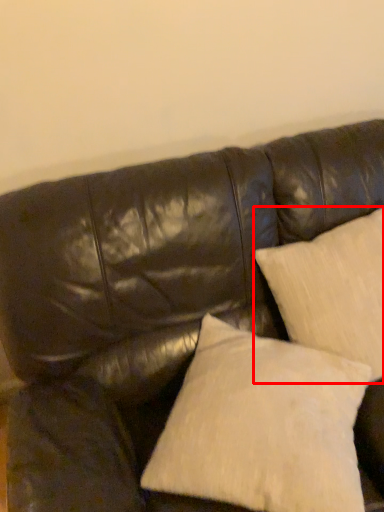
Question: From the image's perspective, what is the correct spatial positioning of pillow (annotated by the red box) in reference to pillow?

Choices:
 (A) above
 (B) below

Answer: (A)